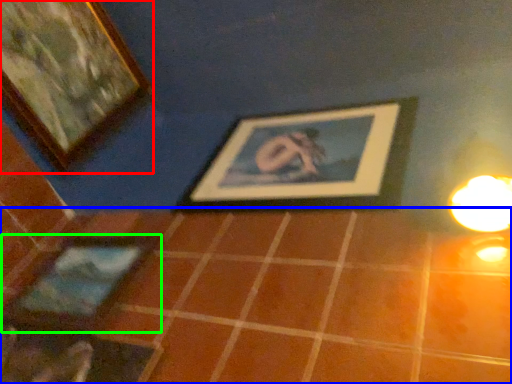
Question: Based on their relative distances, which object is farther from picture frame (highlighted by a red box)? Choose from tile (highlighted by a blue box) and picture frame (highlighted by a green box).

Choices:
 (A) tile
 (B) picture frame

Answer: (A)